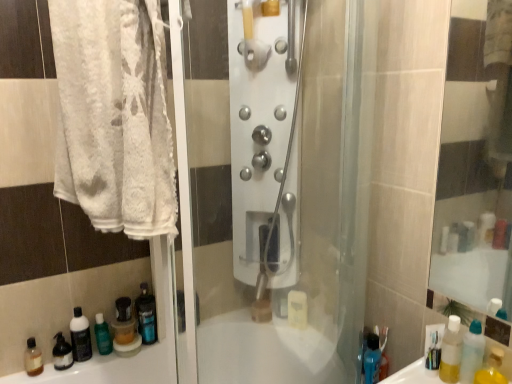
What is the approximate width of brown matte bottle at lower left, the first mouthwash from the left?

brown matte bottle at lower left, the first mouthwash from the left, is 2.23 inches in width.

This screenshot has width=512, height=384. In order to click on satin nickel shower controls at center in this screenshot , I will do 264,141.

What do you see at coordinates (264, 141) in the screenshot? This screenshot has width=512, height=384. I see `satin nickel shower controls at center` at bounding box center [264, 141].

Describe the element at coordinates (124, 322) in the screenshot. The image size is (512, 384). I see `translucent plastic bottle at lower left, arranged as the 3th bottle when viewed from the right` at that location.

At what (x,y) coordinates should I click in order to perform the action: click on translucent plastic mouthwash at lower left, marked as the third mouthwash in a right-to-left arrangement. Please return your answer as a coordinate pair (x, y). This screenshot has height=384, width=512. Looking at the image, I should click on (80, 336).

Locate an element on the screen. The width and height of the screenshot is (512, 384). blue translucent bottle at lower right, the 2th bottle when ordered from front to back is located at coordinates (372, 359).

From the image's perspective, is translucent plastic mouthwash at lower left, placed as the fourth mouthwash when sorted from right to left, above transparent plastic bottle at lower right, the 3th bottle when ordered from back to front?

No, from the image's perspective, translucent plastic mouthwash at lower left, placed as the fourth mouthwash when sorted from right to left, is not above transparent plastic bottle at lower right, the 3th bottle when ordered from back to front.

How distant is translucent plastic mouthwash at lower left, which appears as the 4th mouthwash when viewed from the front, from transparent plastic bottle at lower right, the 3th bottle when ordered from back to front?

4.25 feet.

Is translucent plastic mouthwash at lower left, the 2th mouthwash positioned from the left, touching transparent plastic bottle at lower right, the 3th bottle when ordered from back to front?

No, translucent plastic mouthwash at lower left, the 2th mouthwash positioned from the left, is not beside transparent plastic bottle at lower right, the 3th bottle when ordered from back to front.

Is translucent plastic mouthwash at lower left, which appears as the 4th mouthwash when viewed from the front, to the left of transparent plastic bottle at lower right, the 3th bottle when ordered from back to front, from the viewer's perspective?

Yes.

What's the angular difference between satin nickel shower controls at center and white soft towel at left's facing directions?

The angular difference between satin nickel shower controls at center and white soft towel at left is 84.6 degrees.

In terms of height, does satin nickel shower controls at center look taller or shorter compared to white soft towel at left?

satin nickel shower controls at center is taller than white soft towel at left.

Is satin nickel shower controls at center bigger or smaller than white soft towel at left?

Clearly, satin nickel shower controls at center is larger in size than white soft towel at left.

Between point (236, 88) and point (60, 58), which one is positioned in front?

Positioned in front is point (236, 88).

How much distance is there between satin nickel shower controls at center and brown matte bottle at lower left, placed as the fifth mouthwash when sorted from right to left?

satin nickel shower controls at center is 1.15 meters away from brown matte bottle at lower left, placed as the fifth mouthwash when sorted from right to left.

Which object is positioned more to the right, satin nickel shower controls at center or brown matte bottle at lower left, placed as the fifth mouthwash when sorted from right to left?

Positioned to the right is satin nickel shower controls at center.

Based on the photo, is satin nickel shower controls at center aimed at brown matte bottle at lower left, which is the third mouthwash in back-to-front order?

No, satin nickel shower controls at center is not aimed at brown matte bottle at lower left, which is the third mouthwash in back-to-front order.

Find the location of a particular element. This screenshot has height=384, width=512. shower door on the right of brown matte bottle at lower left, placed as the fifth mouthwash when sorted from right to left is located at coordinates (264, 141).

Does transparent plastic bottle at lower right, which is counted as the first bottle, starting from the right, have a greater width compared to satin nickel shower controls at center?

No.

Which is farther from the camera, (x=465, y=382) or (x=236, y=126)?

The point (x=465, y=382) is more distant.

Is transparent plastic bottle at lower right, which is counted as the first bottle, starting from the right, positioned far away from satin nickel shower controls at center?

That's not correct — transparent plastic bottle at lower right, which is counted as the first bottle, starting from the right, is a little close to satin nickel shower controls at center.

From the image's perspective, would you say transparent plastic bottle at lower right, which is counted as the first bottle, starting from the right, is positioned over satin nickel shower controls at center?

No, from the image's perspective, transparent plastic bottle at lower right, which is counted as the first bottle, starting from the right, is not on top of satin nickel shower controls at center.

In order to click on the 4th mouthwash to the right of the brown matte bottle at lower left, acting as the third mouthwash starting from the front, starting your count from the anchor in this screenshot , I will do `click(451, 351)`.

Considering the positions of points (39, 363) and (448, 326), is point (39, 363) closer to camera compared to point (448, 326)?

No, (39, 363) is further to viewer.

Considering their positions, is brown matte bottle at lower left, acting as the third mouthwash starting from the front, located in front of or behind yellow translucent bottle at lower right, the first mouthwash viewed from the right?

brown matte bottle at lower left, acting as the third mouthwash starting from the front, is behind yellow translucent bottle at lower right, the first mouthwash viewed from the right.

Which object is positioned more to the right, brown matte bottle at lower left, the first mouthwash from the left, or yellow translucent bottle at lower right, placed as the 5th mouthwash when sorted from left to right?

From the viewer's perspective, yellow translucent bottle at lower right, placed as the 5th mouthwash when sorted from left to right, appears more on the right side.

Is point (30, 359) in front of point (265, 240)?

No, it is behind (265, 240).

Consider the image. Considering the relative sizes of brown matte bottle at lower left, which is the third mouthwash in back-to-front order, and satin nickel shower controls at center in the image provided, is brown matte bottle at lower left, which is the third mouthwash in back-to-front order, smaller than satin nickel shower controls at center?

Yes.

How far apart are brown matte bottle at lower left, placed as the fifth mouthwash when sorted from right to left, and satin nickel shower controls at center?

The distance of brown matte bottle at lower left, placed as the fifth mouthwash when sorted from right to left, from satin nickel shower controls at center is 3.79 feet.

Would you consider brown matte bottle at lower left, placed as the fifth mouthwash when sorted from right to left, to be distant from satin nickel shower controls at center?

That's right, there is a large distance between brown matte bottle at lower left, placed as the fifth mouthwash when sorted from right to left, and satin nickel shower controls at center.

Is point (137, 34) less distant than point (118, 337)?

Yes.

In the image, is white soft towel at left positioned in front of or behind translucent plastic bottle at lower left, the 3th bottle from the front?

In the image, white soft towel at left appears in front of translucent plastic bottle at lower left, the 3th bottle from the front.

Is white soft towel at left far from translucent plastic bottle at lower left, the 3th bottle from the front?

No, white soft towel at left is not far away from translucent plastic bottle at lower left, the 3th bottle from the front.

Where is `bottle that is the 3rd object to the right of the translucent plastic mouthwash at lower left, the 2th mouthwash positioned from the left, starting at the anchor`? bottle that is the 3rd object to the right of the translucent plastic mouthwash at lower left, the 2th mouthwash positioned from the left, starting at the anchor is located at coordinates (472, 352).

You are a GUI agent. You are given a task and a screenshot of the screen. Output one action in this format:
    pyautogui.click(x=<x>, y=<y>)
    Task: Click on the shower door behind the white soft towel at left
    
    Given the screenshot: What is the action you would take?
    pyautogui.click(x=264, y=141)

Based on the photo, looking at the image, which one is located further to green matte bottle at lower left, translucent plastic bottle at lower left, arranged as the 3th bottle when viewed from the right, or translucent plastic mouthwash at lower left, which appears as the 4th mouthwash when viewed from the front?

translucent plastic mouthwash at lower left, which appears as the 4th mouthwash when viewed from the front, is further to green matte bottle at lower left.

Based on their spatial positions, is green matte bottle at lower left or transparent plastic bottle at lower right, the third bottle viewed from the left, further from satin nickel shower controls at center?

green matte bottle at lower left is further to satin nickel shower controls at center.

Considering their positions, is satin nickel shower controls at center positioned further to white soft towel at left than translucent plastic bottle at lower left, the 1th bottle in the back-to-front sequence?

The object further to white soft towel at left is translucent plastic bottle at lower left, the 1th bottle in the back-to-front sequence.

Consider the image. Based on their spatial positions, is white soft towel at left or blue translucent bottle at lower right, positioned as the 2th bottle in left-to-right order, further from yellow translucent bottle at lower right, the fifth mouthwash when ordered from back to front?

white soft towel at left is positioned further to the anchor yellow translucent bottle at lower right, the fifth mouthwash when ordered from back to front.

Estimate the real-world distances between objects in this image. Which object is closer to white soft towel at left, white glossy mouthwash at lower right, the 4th mouthwash from the left, or translucent plastic mouthwash at lower left, arranged as the 1th mouthwash when viewed from the back?

Based on the image, translucent plastic mouthwash at lower left, arranged as the 1th mouthwash when viewed from the back, appears to be nearer to white soft towel at left.

Considering their positions, is green matte bottle at lower left positioned closer to white glossy mouthwash at lower right, placed as the 4th mouthwash when sorted from back to front, than satin nickel shower controls at center?

satin nickel shower controls at center is positioned closer to the anchor white glossy mouthwash at lower right, placed as the 4th mouthwash when sorted from back to front.

Estimate the real-world distances between objects in this image. Which object is closer to transparent plastic bottle at lower right, which is counted as the first bottle, starting from the right, white soft towel at left or translucent plastic mouthwash at lower left, the 2th mouthwash positioned from the left?

white soft towel at left lies closer to transparent plastic bottle at lower right, which is counted as the first bottle, starting from the right, than the other object.

Which object lies further to the anchor point translucent plastic mouthwash at lower left, which appears as the 4th mouthwash when viewed from the front, satin nickel shower controls at center or white soft towel at left?

satin nickel shower controls at center is further to translucent plastic mouthwash at lower left, which appears as the 4th mouthwash when viewed from the front.

Locate an element on the screen. cleaning product between brown matte bottle at lower left, the first mouthwash from the left, and transparent plastic bottle at lower right, acting as the 1th bottle starting from the front, in the horizontal direction is located at coordinates (102, 335).

Where is `towel between translucent plastic mouthwash at lower left, which appears as the 4th mouthwash when viewed from the front, and yellow translucent bottle at lower right, the 1th mouthwash in the front-to-back sequence, from left to right`? The image size is (512, 384). towel between translucent plastic mouthwash at lower left, which appears as the 4th mouthwash when viewed from the front, and yellow translucent bottle at lower right, the 1th mouthwash in the front-to-back sequence, from left to right is located at coordinates (114, 115).

Find the location of a particular element. The width and height of the screenshot is (512, 384). shower door situated between brown matte bottle at lower left, the first mouthwash from the left, and blue translucent bottle at lower right, positioned as the 2th bottle in left-to-right order, from left to right is located at coordinates (264, 141).

The image size is (512, 384). Find the location of `shower door between translucent plastic mouthwash at lower left, arranged as the 1th mouthwash when viewed from the back, and white glossy mouthwash at lower right, placed as the 4th mouthwash when sorted from back to front`. shower door between translucent plastic mouthwash at lower left, arranged as the 1th mouthwash when viewed from the back, and white glossy mouthwash at lower right, placed as the 4th mouthwash when sorted from back to front is located at coordinates (264, 141).